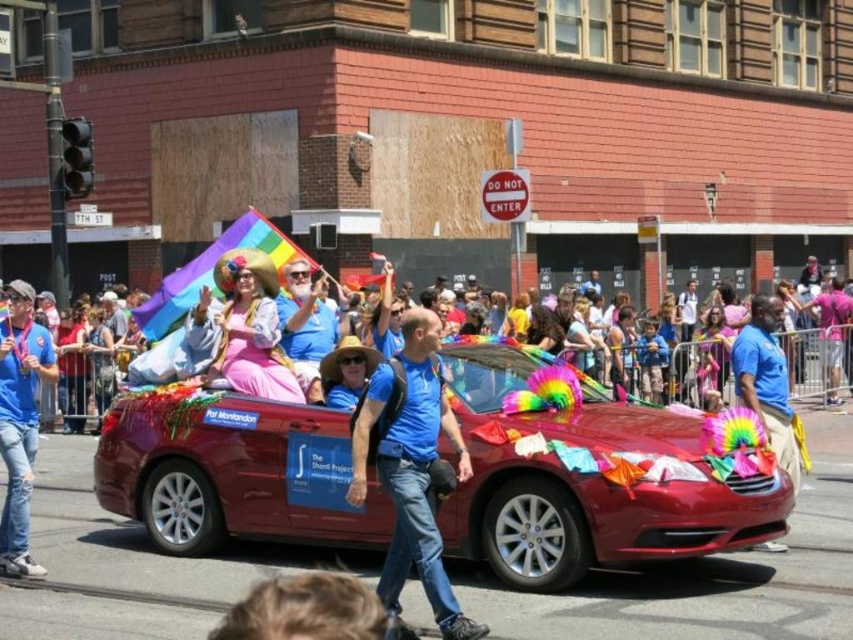
Between point (448, 584) and point (320, 392), which one is positioned in front?

Positioned in front is point (448, 584).

How distant is blue cotton shirt at center from matte blue shirt at center?

blue cotton shirt at center and matte blue shirt at center are 2.05 meters apart.

Is point (421, 552) behind point (306, 340)?

No.

This screenshot has width=853, height=640. Identify the location of blue cotton shirt at center. (421, 477).

Between pastel fabric dress at center and matte blue shirt at center, which one appears on the left side from the viewer's perspective?

pastel fabric dress at center

Consider the image. Is the position of pastel fabric dress at center more distant than that of matte blue shirt at center?

That is True.

Between point (231, 314) and point (311, 392), which one is positioned in front?

Point (311, 392)

Where is `pastel fabric dress at center`? This screenshot has width=853, height=640. pastel fabric dress at center is located at coordinates (250, 330).

Measure the distance from pastel fabric dress at center to blonde hair at lower center.

pastel fabric dress at center and blonde hair at lower center are 5.86 feet apart.

Can you confirm if pastel fabric dress at center is positioned to the left of blonde hair at lower center?

Correct, you'll find pastel fabric dress at center to the left of blonde hair at lower center.

Who is more distant from viewer, (271, 328) or (370, 637)?

Point (271, 328)

Locate an element on the screen. This screenshot has width=853, height=640. pastel fabric dress at center is located at coordinates (250, 330).